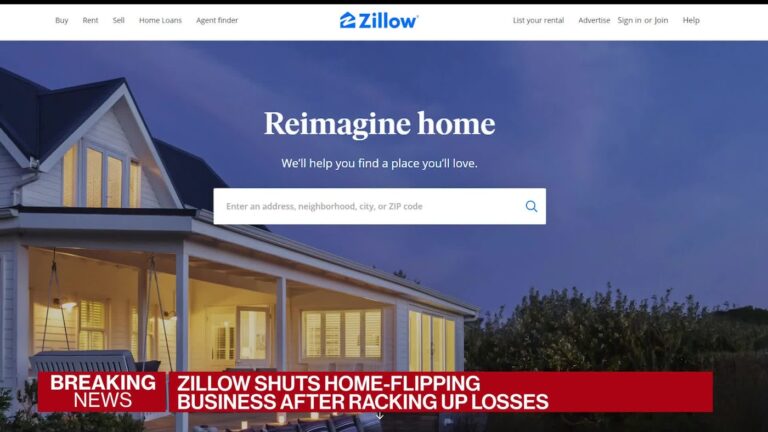
Locate an element on the screen. white door is located at coordinates (220, 362).